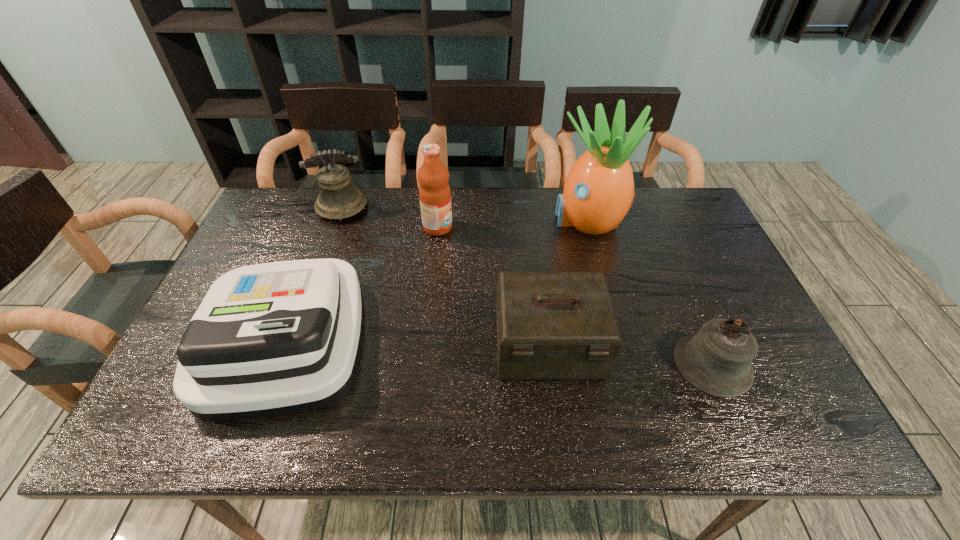
Find the location of a particular element. This screenshot has width=960, height=540. vacant space at the far right corner is located at coordinates (677, 191).

The width and height of the screenshot is (960, 540). I want to click on free space between the cash register and the first-aid kit, so click(416, 342).

This screenshot has height=540, width=960. In order to click on free space between the first-aid kit and the fruit juice in this screenshot , I will do `click(493, 286)`.

Image resolution: width=960 pixels, height=540 pixels. I want to click on free spot between the fourth object from right to left and the first-aid kit, so click(x=493, y=286).

Locate an element on the screen. The width and height of the screenshot is (960, 540). free space between the first-aid kit and the farther bell is located at coordinates (445, 276).

What are the coordinates of `free spot between the cash register and the fruit juice` in the screenshot? It's located at (361, 283).

Find the location of a particular element. This screenshot has width=960, height=540. free point between the cash register and the fifth shortest object is located at coordinates (361, 283).

The width and height of the screenshot is (960, 540). In order to click on object that is the second closest one to the right bell in this screenshot , I will do `click(598, 192)`.

Locate an element on the screen. object that stands as the closest to the farther bell is located at coordinates (434, 191).

What are the coordinates of `free region that satisfies the following two spatial constraints: 1. on the front label of the nearer bell; 2. on the left side of the fruit juice` in the screenshot? It's located at (423, 364).